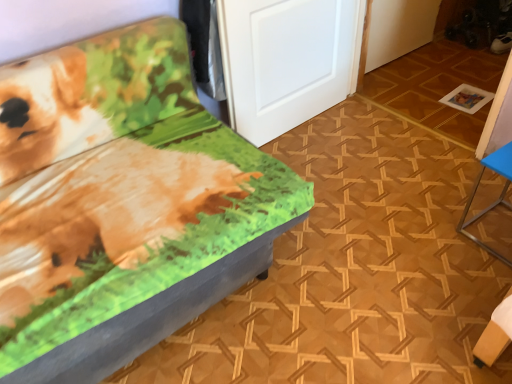
Where is `vacant space to the right of white matte door at center`? vacant space to the right of white matte door at center is located at coordinates (368, 137).